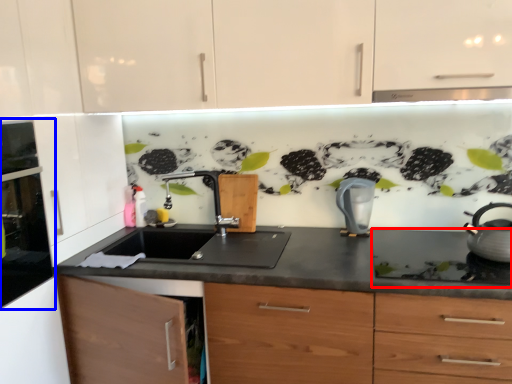
Question: Which of the following is the closest to the observer, gas stove (highlighted by a red box) or home appliance (highlighted by a blue box)?

Choices:
 (A) gas stove
 (B) home appliance

Answer: (B)